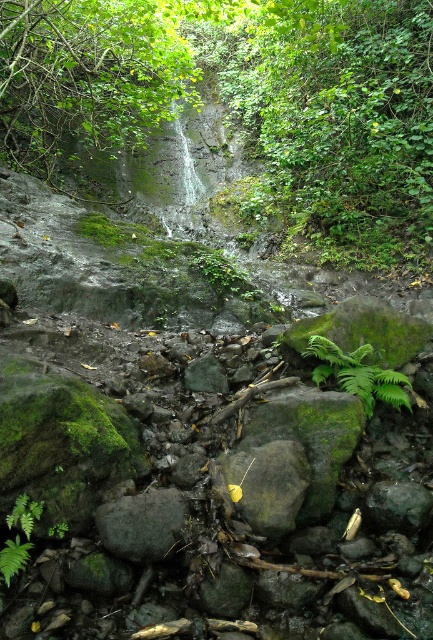
Can you confirm if green leafy tree at upper center is positioned to the right of green leafy fern at center?

Incorrect, green leafy tree at upper center is not on the right side of green leafy fern at center.

Can you confirm if green leafy tree at upper center is positioned below green leafy fern at center?

No.

The height and width of the screenshot is (640, 433). Identify the location of green leafy tree at upper center. (87, 77).

Who is positioned more to the left, green leafy tree at upper center or green mossy rock at center?

Positioned to the left is green leafy tree at upper center.

Does green leafy tree at upper center come behind green mossy rock at center?

That is True.

Does point (29, 125) come in front of point (177, 492)?

No, (29, 125) is behind (177, 492).

Locate an element on the screen. green leafy tree at upper center is located at coordinates point(87,77).

Does point (93, 516) lie behind point (354, 355)?

No, it is not.

Does green mossy rock at center appear on the right side of green leafy fern at center?

No, green mossy rock at center is not to the right of green leafy fern at center.

Who is more forward, (129, 532) or (384, 392)?

Point (129, 532) is more forward.

You are a GUI agent. You are given a task and a screenshot of the screen. Output one action in this format:
    pyautogui.click(x=<x>, y=<y>)
    Task: Click on the green mossy rock at center
    
    Given the screenshot: What is the action you would take?
    pyautogui.click(x=142, y=524)